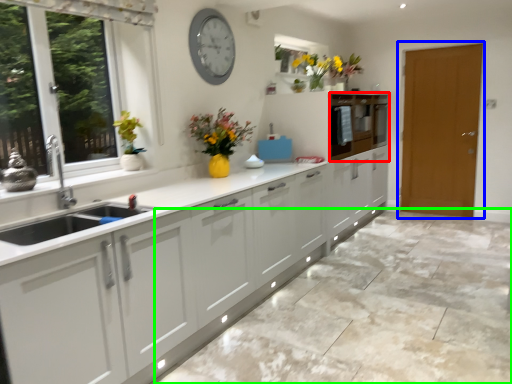
Question: Which is nearer to the cabinetry (highlighted by a red box)? door (highlighted by a blue box) or granite (highlighted by a green box).

Choices:
 (A) door
 (B) granite

Answer: (A)